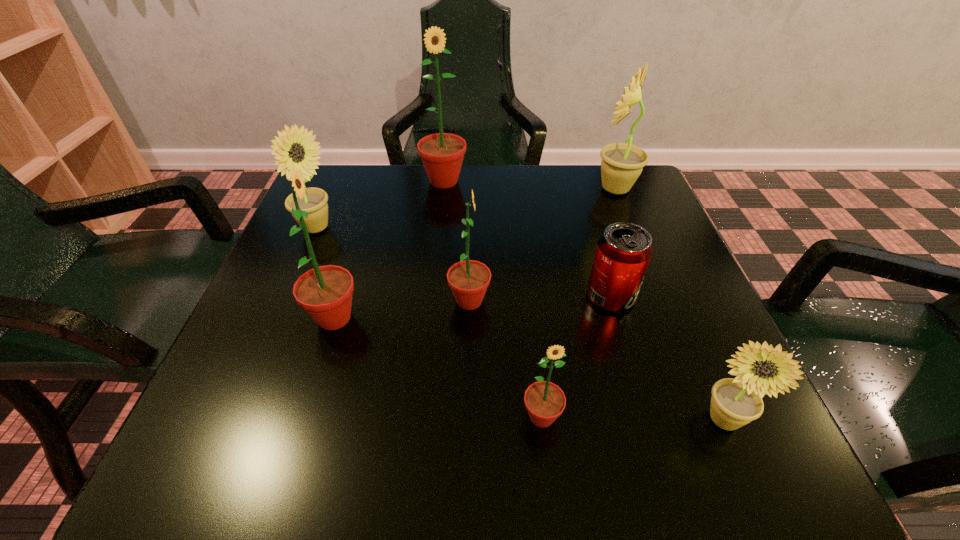
Find the location of a particular element. This screenshot has height=540, width=960. blank area in the image that satisfies the following two spatial constraints: 1. on the face of the leftmost yellow sunflower; 2. on the right side of the shortest object is located at coordinates (286, 296).